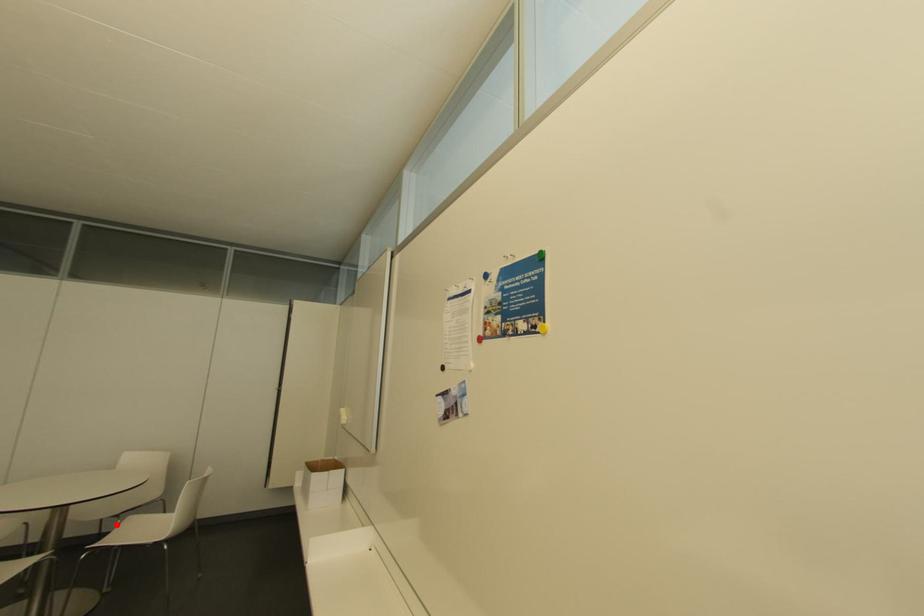
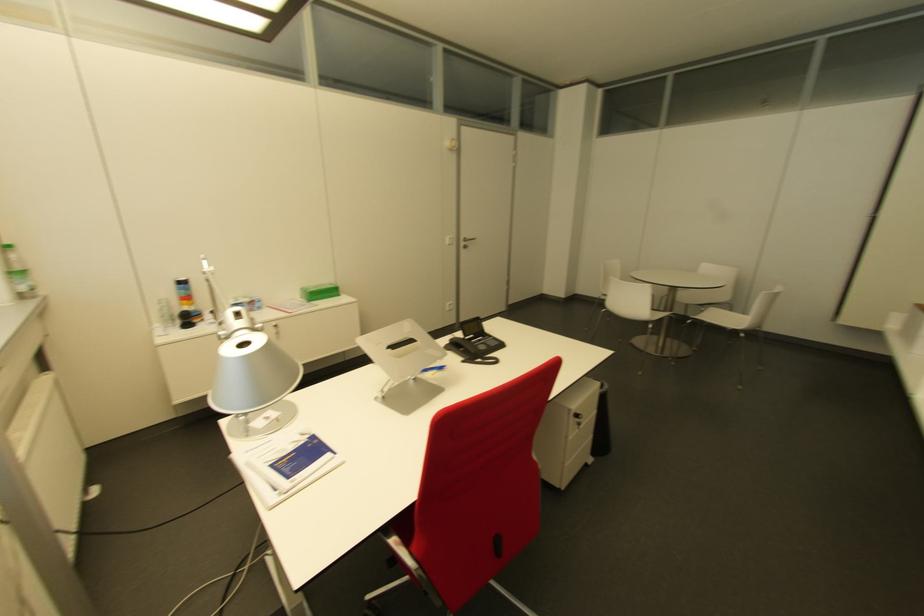
Question: A red point is marked in image1. In image2, is the corresponding 3D point closer to the camera or farther? Reply with the corresponding letter.

Choices:
 (A) The corresponding 3D point is closer.
 (B) The corresponding 3D point is farther.

Answer: (A)